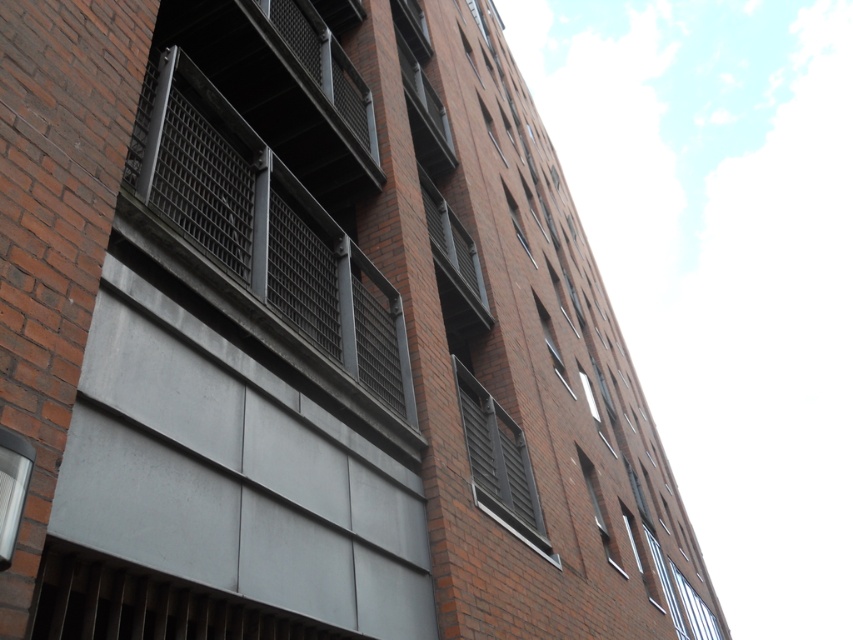
Which is below, metallic gray vent at center or clear glass window at lower left?

clear glass window at lower left is lower down.

Can you confirm if metallic gray vent at center is bigger than clear glass window at lower left?

Yes, metallic gray vent at center is bigger than clear glass window at lower left.

Looking at this image, who is more forward, [479,278] or [7,552]?

Point [7,552]

You are a GUI agent. You are given a task and a screenshot of the screen. Output one action in this format:
    pyautogui.click(x=<x>, y=<y>)
    Task: Click on the metallic gray vent at center
    
    Given the screenshot: What is the action you would take?
    pyautogui.click(x=453, y=243)

Does matte gray window at center have a smaller size compared to metallic gray vent at center?

Actually, matte gray window at center might be larger than metallic gray vent at center.

Between matte gray window at center and metallic gray vent at center, which one appears on the right side from the viewer's perspective?

Positioned to the right is matte gray window at center.

Locate an element on the screen. matte gray window at center is located at coordinates (498, 464).

What do you see at coordinates (453, 243) in the screenshot? I see `metallic gray vent at center` at bounding box center [453, 243].

Does metallic gray vent at center have a lesser width compared to clear glass window at lower right?

Yes.

Image resolution: width=853 pixels, height=640 pixels. What do you see at coordinates (453, 243) in the screenshot?
I see `metallic gray vent at center` at bounding box center [453, 243].

The width and height of the screenshot is (853, 640). Find the location of `metallic gray vent at center`. metallic gray vent at center is located at coordinates (453, 243).